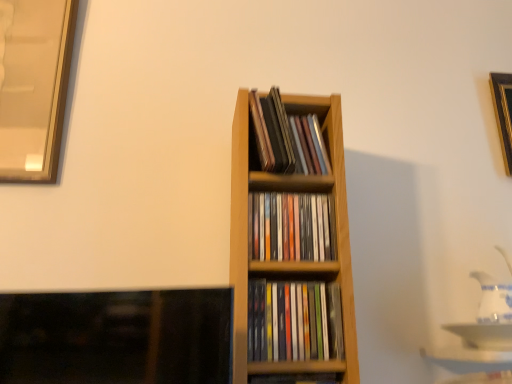
Question: Would you say wooden bookshelf at center, the fourth book positioned from the top, is to the left or to the right of wooden cd case at center, which appears as the 3th book when ordered from the bottom, in the picture?

Choices:
 (A) right
 (B) left

Answer: (A)

Question: From their relative heights in the image, would you say wooden bookshelf at center, the fourth book positioned from the top, is taller or shorter than wooden cd case at center, which appears as the 3th book when ordered from the bottom?

Choices:
 (A) short
 (B) tall

Answer: (A)

Question: Which is nearer to the wooden cd case at center, which is counted as the 1th book, starting from the top?

Choices:
 (A) wooden bookshelf at center, which is the 1th book in bottom-to-top order
 (B) wooden cd case at center, which appears as the 3th book when ordered from the bottom
 (C) multicolored plastic cds at center, the third book viewed from the top
 (D) white glossy tea pot at right
 (E) gold metallic picture frame at upper right

Answer: (B)

Question: Estimate the real-world distances between objects in this image. Which object is closer to the gold metallic picture frame at upper right?

Choices:
 (A) white glossy tea pot at right
 (B) multicolored plastic cds at center, which appears as the second book when ordered from the bottom
 (C) wooden bookshelf at center, which is the 1th book in bottom-to-top order
 (D) wooden cd case at center, which is counted as the 1th book, starting from the top
 (E) wooden cd case at center, which appears as the 3th book when ordered from the bottom

Answer: (A)